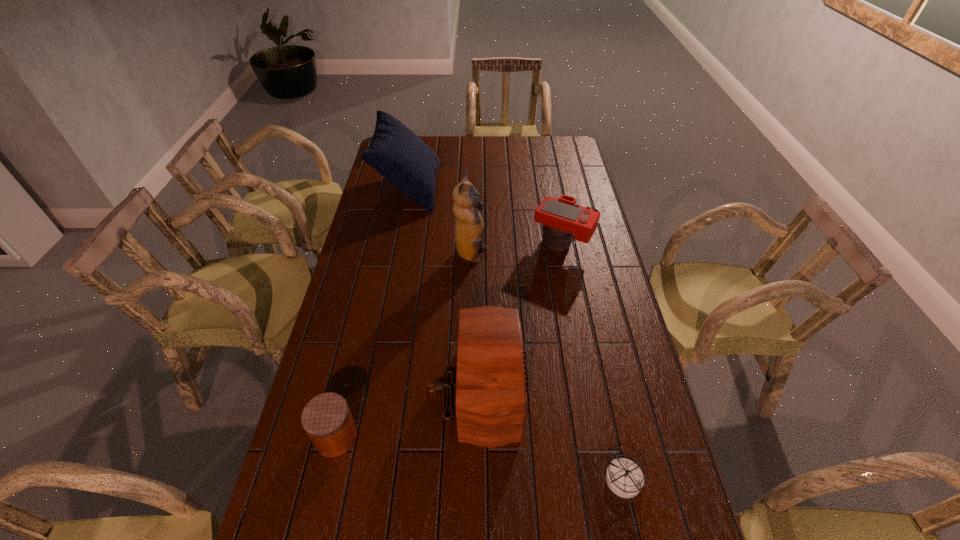
At what (x,y) coordinates should I click in order to perform the action: click on the tallest object. Please return your answer as a coordinate pair (x, y). This screenshot has width=960, height=540. Looking at the image, I should click on (469, 231).

At what (x,y) coordinates should I click in order to perform the action: click on cushion. Please return your answer as a coordinate pair (x, y). The height and width of the screenshot is (540, 960). Looking at the image, I should click on (395, 152).

At what (x,y) coordinates should I click in order to perform the action: click on the farthest object. Please return your answer as a coordinate pair (x, y). The image size is (960, 540). Looking at the image, I should click on pyautogui.click(x=395, y=152).

I want to click on the fourth shortest object, so click(491, 394).

Locate an element on the screen. the fourth tallest object is located at coordinates (562, 217).

You are a GUI agent. You are given a task and a screenshot of the screen. Output one action in this format:
    pyautogui.click(x=<x>, y=<y>)
    Task: Click on the jar
    Image resolution: width=960 pixels, height=540 pixels.
    Given the screenshot: What is the action you would take?
    pyautogui.click(x=326, y=418)

Find the location of `the nearest object`. the nearest object is located at coordinates (624, 477).

Image resolution: width=960 pixels, height=540 pixels. I want to click on compass, so (x=624, y=477).

The image size is (960, 540). I want to click on vacant space situated on the face of the tallest object, so click(x=531, y=255).

The height and width of the screenshot is (540, 960). I want to click on vacant space located 0.180m on the facing side of the cushion, so click(x=480, y=187).